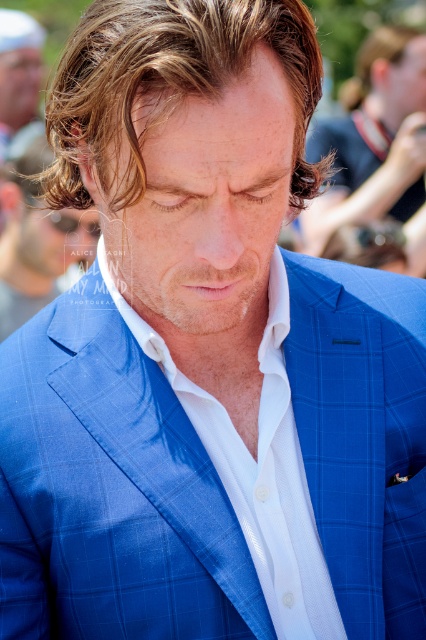
Does blue checkered suit at center have a greater height compared to brown wavy hair at upper right?

Yes, blue checkered suit at center is taller than brown wavy hair at upper right.

The image size is (426, 640). What are the coordinates of `blue checkered suit at center` in the screenshot? It's located at (377, 147).

Between white textured shirt at center and brown smooth hair at center, which one is positioned lower?

Positioned lower is white textured shirt at center.

Does white textured shirt at center have a lesser width compared to brown smooth hair at center?

Indeed, white textured shirt at center has a lesser width compared to brown smooth hair at center.

Where is `white textured shirt at center`? white textured shirt at center is located at coordinates (259, 470).

This screenshot has height=640, width=426. In order to click on white textured shirt at center in this screenshot , I will do `click(259, 470)`.

Measure the distance between golden brown hair at center and camera.

A distance of 3.54 feet exists between golden brown hair at center and camera.

Is golden brown hair at center shorter than blue checkered suit at center?

Yes.

Is point (146, 49) less distant than point (417, 262)?

Yes.

Where is `golden brown hair at center`? This screenshot has height=640, width=426. golden brown hair at center is located at coordinates (169, 80).